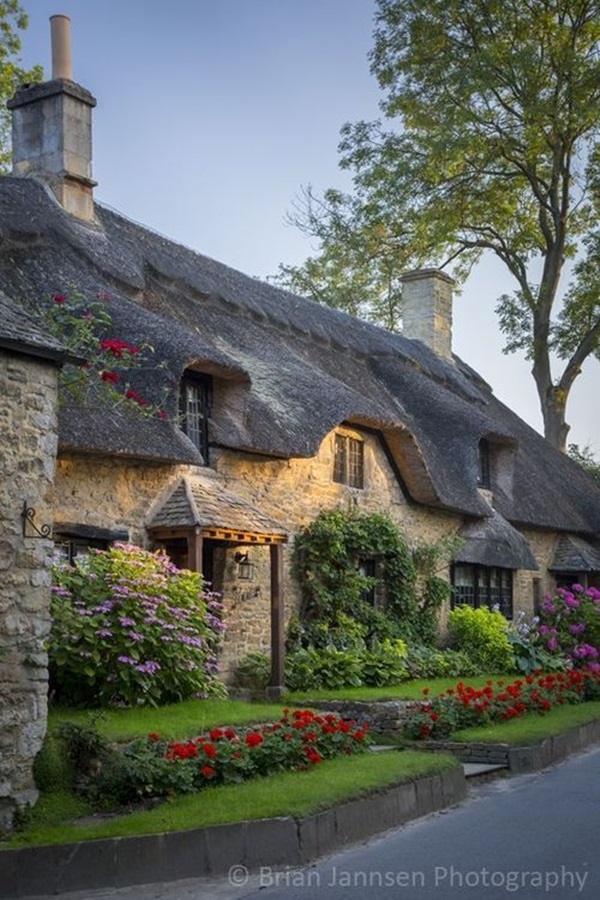
Identify the location of window. Image resolution: width=600 pixels, height=900 pixels. (82, 551), (210, 433), (352, 474), (499, 596), (488, 478).